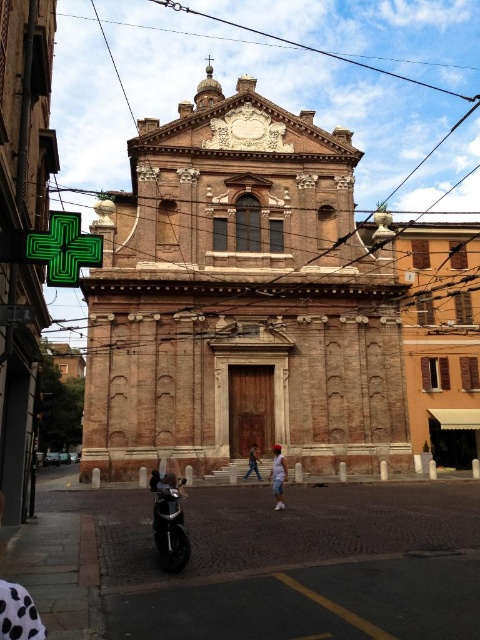
Question: Which object appears farthest from the camera in this image?

Choices:
 (A) denim pants at center
 (B) light blue denim shorts at center
 (C) shiny black motorcycle at center

Answer: (A)

Question: Is light blue denim shorts at center above denim pants at center?

Choices:
 (A) yes
 (B) no

Answer: (B)

Question: Is brown brick church at center to the left of light blue denim shorts at center from the viewer's perspective?

Choices:
 (A) yes
 (B) no

Answer: (A)

Question: Does brown brick church at center come behind shiny black motorcycle at center?

Choices:
 (A) yes
 (B) no

Answer: (A)

Question: Among these points, which one is farthest from the camera?

Choices:
 (A) (256, 170)
 (B) (253, 451)

Answer: (A)

Question: Considering the real-world distances, which object is farthest from the brown brick church at center?

Choices:
 (A) shiny black motorcycle at center
 (B) denim pants at center

Answer: (B)